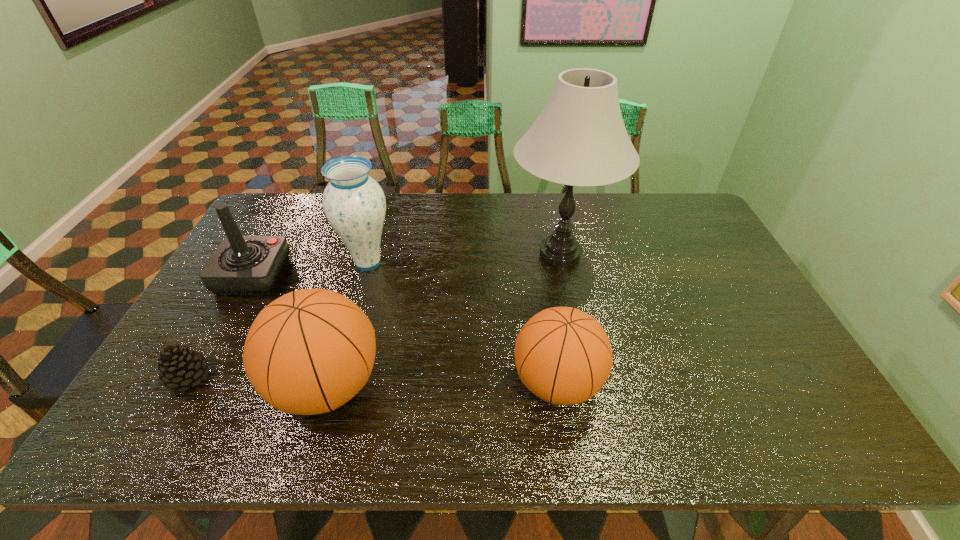
Locate an element on the screen. vacant space located 0.180m on the front-facing side of the joystick is located at coordinates (344, 276).

What are the coordinates of `vacant region located 0.310m on the left of the tallest object` in the screenshot? It's located at (412, 254).

Where is `vacant position located at the narrow end of the shortest object`? This screenshot has width=960, height=540. vacant position located at the narrow end of the shortest object is located at coordinates (307, 377).

This screenshot has height=540, width=960. I want to click on object present at the far edge, so click(579, 139).

Where is `pinecone that is at the near edge`? The image size is (960, 540). pinecone that is at the near edge is located at coordinates (179, 366).

Where is `joystick that is at the left edge`? This screenshot has height=540, width=960. joystick that is at the left edge is located at coordinates (241, 265).

Identify the location of pinecone located at the left edge. The image size is (960, 540). (179, 366).

Where is `object located at the near left corner`? object located at the near left corner is located at coordinates (179, 366).

In the image, there is a desktop. At what (x,y) coordinates should I click in order to perform the action: click on vacant space at the far edge. Please return your answer as a coordinate pair (x, y). This screenshot has width=960, height=540. Looking at the image, I should click on (614, 210).

This screenshot has height=540, width=960. What are the coordinates of `free space at the near edge` in the screenshot? It's located at (398, 382).